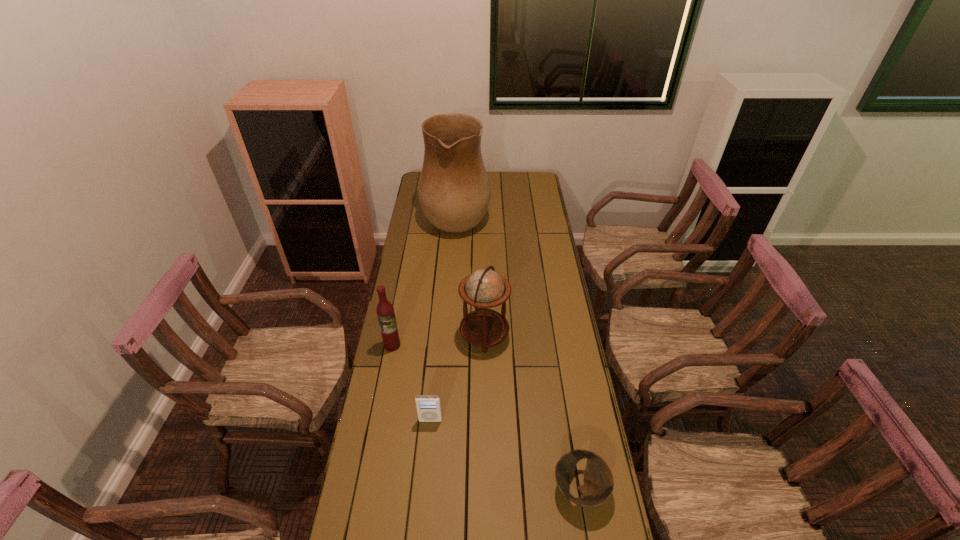
At what (x,y) coordinates should I click in order to perform the action: click on vacant space that satisfies the following two spatial constraints: 1. at the spout of the cream pitcher; 2. on the label of the liquor. Please return your answer as a coordinate pair (x, y). This screenshot has width=960, height=540. Looking at the image, I should click on (447, 345).

The width and height of the screenshot is (960, 540). I want to click on free space that satisfies the following two spatial constraints: 1. on the surface of the globe; 2. on the back side of the bowl, so click(x=486, y=489).

The height and width of the screenshot is (540, 960). Find the location of `free space that satisfies the following two spatial constraints: 1. on the surface of the globe; 2. on the right side of the rightmost object`. free space that satisfies the following two spatial constraints: 1. on the surface of the globe; 2. on the right side of the rightmost object is located at coordinates (486, 489).